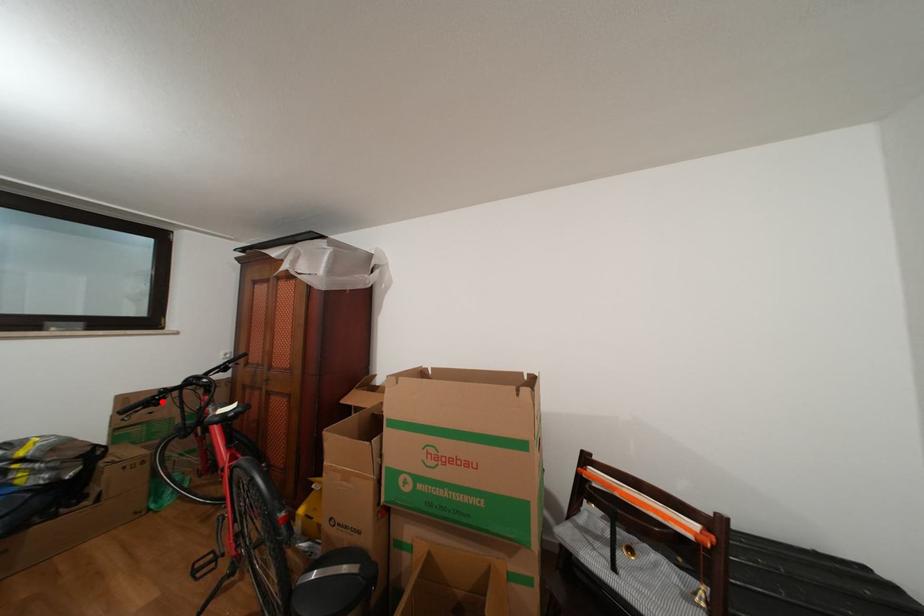
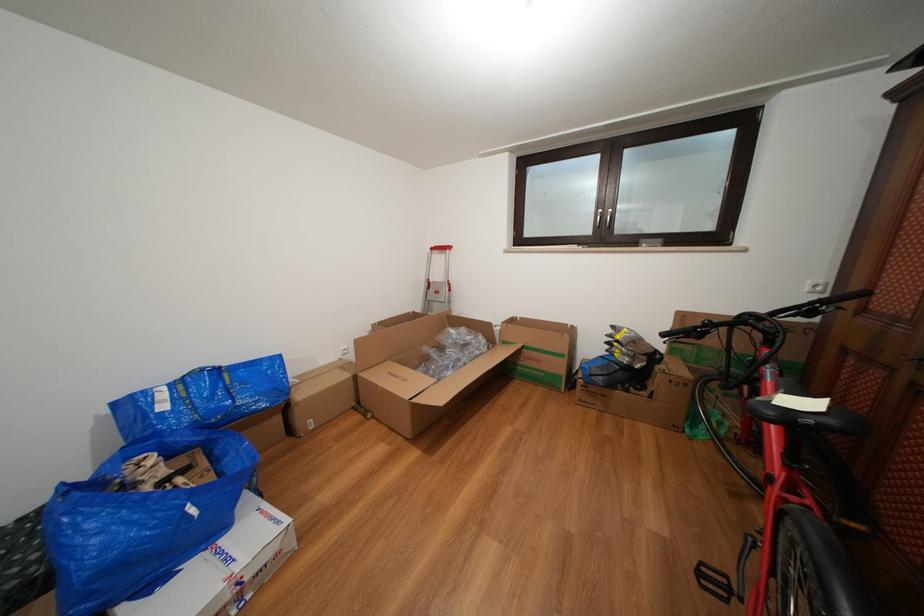
Question: A red point is marked in image1. In image2, is the corresponding 3D point closer to the camera or farther? Reply with the corresponding letter.

Choices:
 (A) The corresponding 3D point is closer.
 (B) The corresponding 3D point is farther.

Answer: (A)